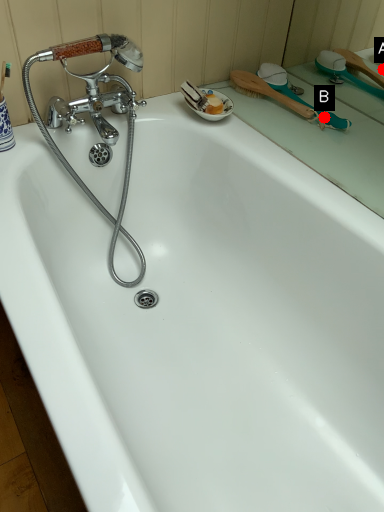
Question: Two points are circled on the image, labeled by A and B beside each circle. Among these points, which one is farthest from the camera?

Choices:
 (A) A is further
 (B) B is further

Answer: (A)